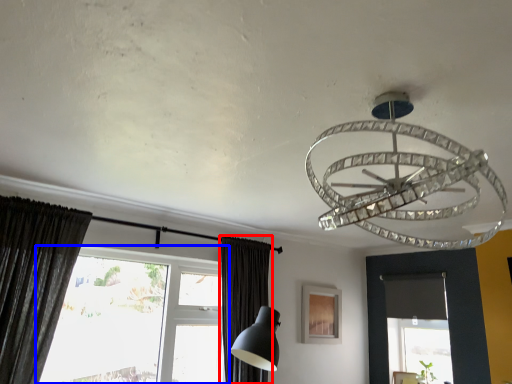
Question: Which point is closer to the camera, curtain (highlighted by a red box) or window (highlighted by a blue box)?

Choices:
 (A) curtain
 (B) window

Answer: (B)